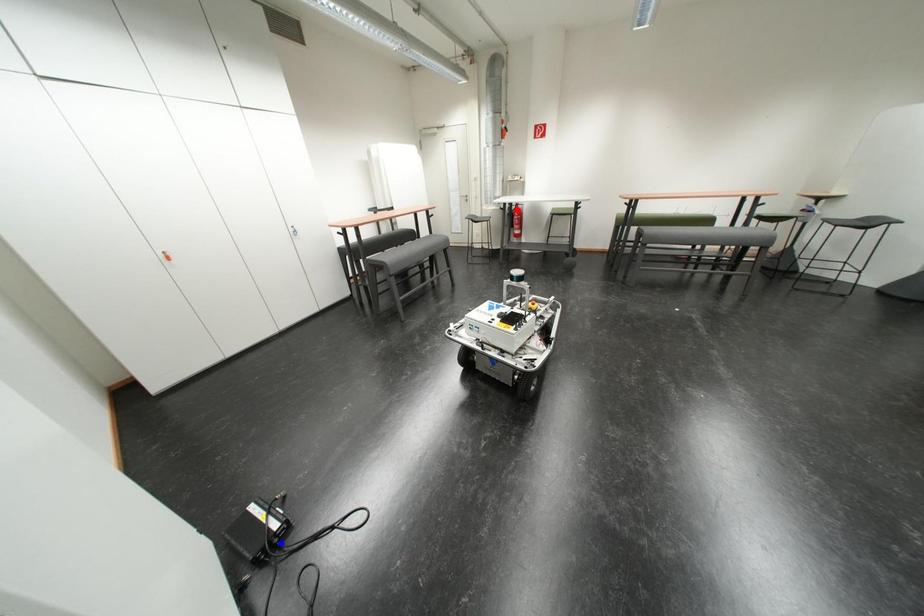
Question: Two points are marked on the image. Which point is closer to the camera?

Choices:
 (A) Blue point is closer.
 (B) Red point is closer.

Answer: (A)